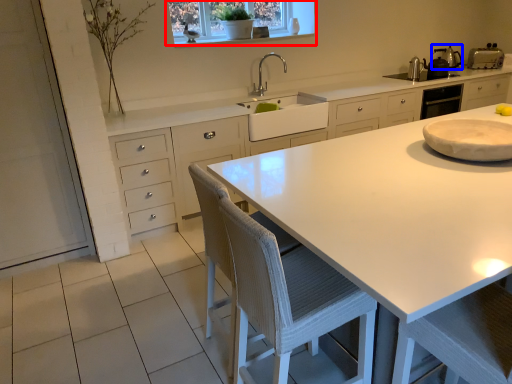
Question: Among these objects, which one is nearest to the camera, window (highlighted by a red box) or appliance (highlighted by a blue box)?

Choices:
 (A) window
 (B) appliance

Answer: (A)